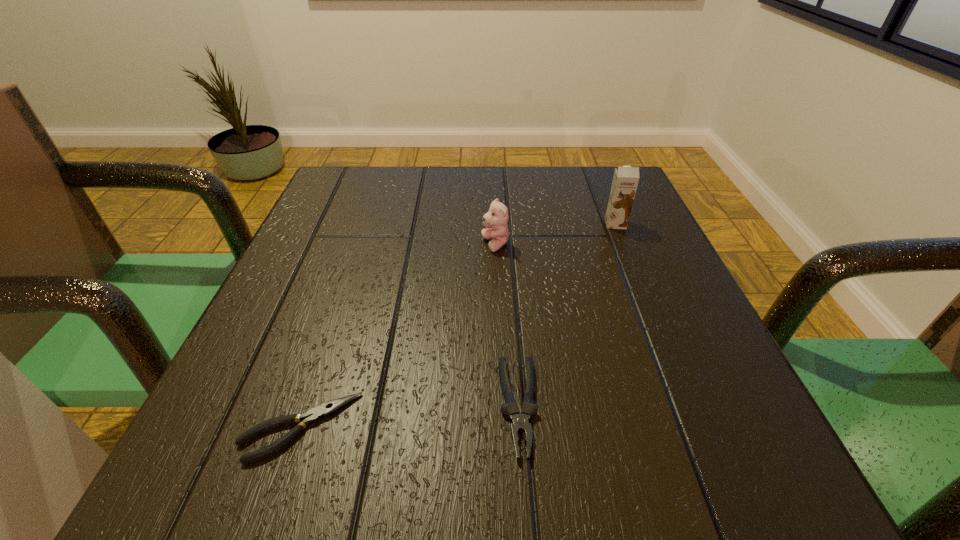
Find the location of a particular element. the rightmost object is located at coordinates (625, 181).

This screenshot has width=960, height=540. Identify the location of the tallest object. (625, 181).

Where is `teddy bear`? This screenshot has height=540, width=960. teddy bear is located at coordinates (497, 217).

Identify the location of the second farthest object. The image size is (960, 540). (497, 217).

Find the location of a particular element. Image resolution: width=960 pixels, height=540 pixels. the second shortest object is located at coordinates (520, 421).

Identify the location of the taller pliers. (520, 421).

Identify the location of the shortest object. The height and width of the screenshot is (540, 960). (314, 415).

Find the location of `the leftmost object`. the leftmost object is located at coordinates 314,415.

The height and width of the screenshot is (540, 960). What are the coordinates of `vacant region located 0.320m on the left of the tallest object` in the screenshot? It's located at (454, 224).

What are the coordinates of `free space located at the face of the teddy bear` in the screenshot? It's located at (355, 245).